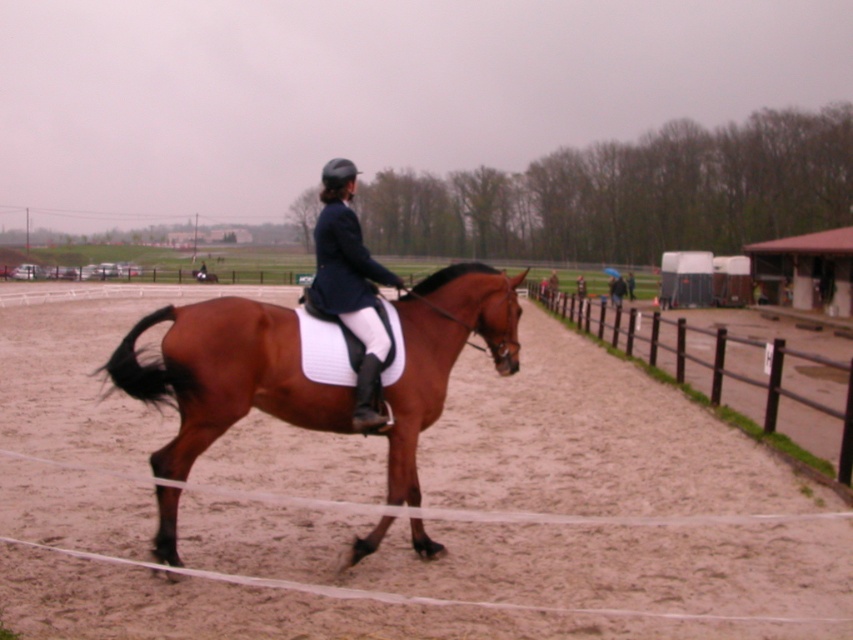
Question: Does brown wooden fence at right appear on the left side of matte black riding jacket at center?

Choices:
 (A) yes
 (B) no

Answer: (B)

Question: Which object appears farthest from the camera in this image?

Choices:
 (A) brown sand at center
 (B) brown glossy horse at center
 (C) brown wooden fence at right

Answer: (C)

Question: Among these points, which one is nearest to the camera?

Choices:
 (A) (189, 404)
 (B) (700, 595)
 (C) (773, 397)
 (D) (374, 317)

Answer: (A)

Question: Which point is closer to the camera?

Choices:
 (A) (413, 324)
 (B) (675, 547)

Answer: (A)

Question: Can you confirm if brown wooden fence at right is positioned above matte black riding jacket at center?

Choices:
 (A) no
 (B) yes

Answer: (A)

Question: Observing the image, what is the correct spatial positioning of brown glossy horse at center in reference to matte black riding jacket at center?

Choices:
 (A) above
 (B) below

Answer: (B)